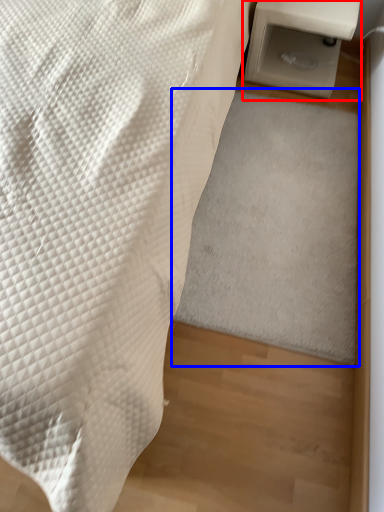
Question: Among these objects, which one is nearest to the camera, table (highlighted by a red box) or mat (highlighted by a blue box)?

Choices:
 (A) table
 (B) mat

Answer: (B)